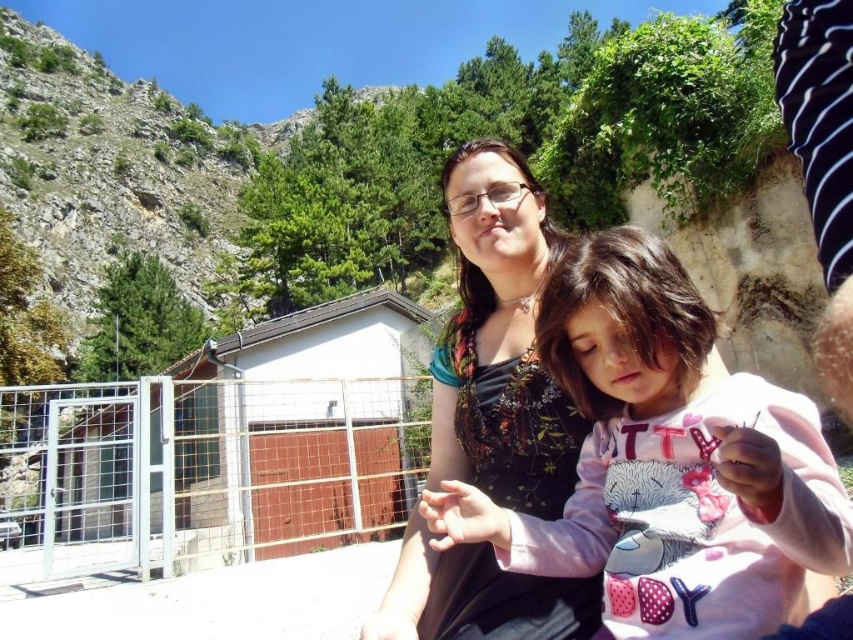
Which is in front, point (759, 392) or point (467, 596)?

Point (759, 392) is in front.

Is pink fleece sweater at center bigger than matte floral dress at center?

No.

Find the location of `pink fleece sweater at center`. pink fleece sweater at center is located at coordinates (665, 461).

The image size is (853, 640). Find the location of `pink fleece sweater at center`. pink fleece sweater at center is located at coordinates (665, 461).